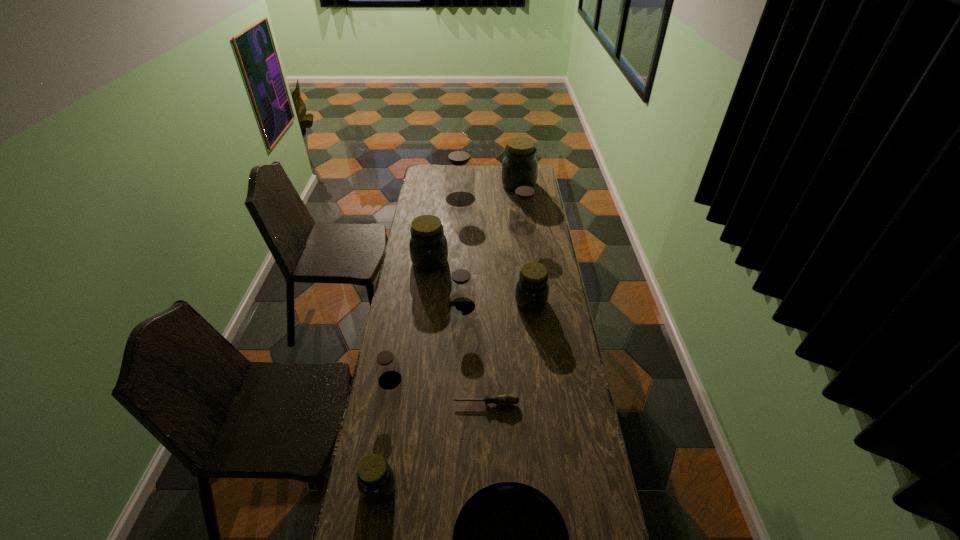
Locate an element on the screen. The image size is (960, 540). the nearest jar is located at coordinates (375, 478).

You are a GUI agent. You are given a task and a screenshot of the screen. Output one action in this format:
    pyautogui.click(x=<x>, y=<y>)
    Task: Click on the nearest green jar
    
    Given the screenshot: What is the action you would take?
    pyautogui.click(x=375, y=478)

Identify the location of the shortest object. (506, 399).

You are a GUI agent. You are given a task and a screenshot of the screen. Output one action in this format:
    pyautogui.click(x=<x>, y=<y>)
    Task: Click on the gray screwdriver
    
    Given the screenshot: What is the action you would take?
    pyautogui.click(x=506, y=399)

Find the location of a particular element. The width and height of the screenshot is (960, 540). vacant area located on the right of the farthest brown jar is located at coordinates (537, 199).

Identify the location of free space located on the front of the farthest green jar. (522, 217).

Where is `free region located 0.060m on the back of the third farthest jar`? The image size is (960, 540). free region located 0.060m on the back of the third farthest jar is located at coordinates (520, 214).

The height and width of the screenshot is (540, 960). What are the coordinates of `vacant area situated on the back of the fourth farthest jar` in the screenshot? It's located at (434, 230).

I want to click on free location located on the front of the third farthest brown jar, so click(458, 397).

The width and height of the screenshot is (960, 540). Find the location of `vacant space located on the back of the second nearest green jar`. vacant space located on the back of the second nearest green jar is located at coordinates (527, 271).